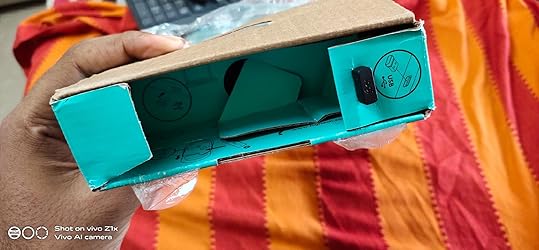
Find the location of a particular element. Image resolution: width=539 pixels, height=250 pixels. speaker is located at coordinates (369, 89).